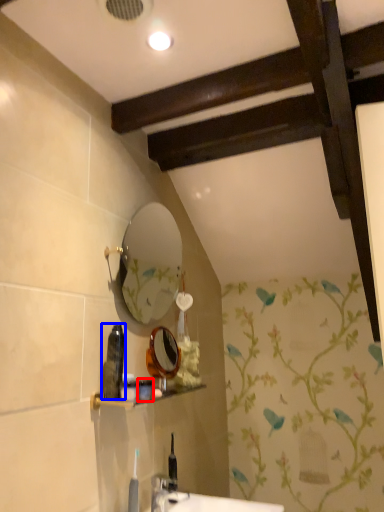
Question: Which of the following is the farthest to the observer, toiletry (highlighted by a red box) or toiletry (highlighted by a blue box)?

Choices:
 (A) toiletry
 (B) toiletry

Answer: (A)